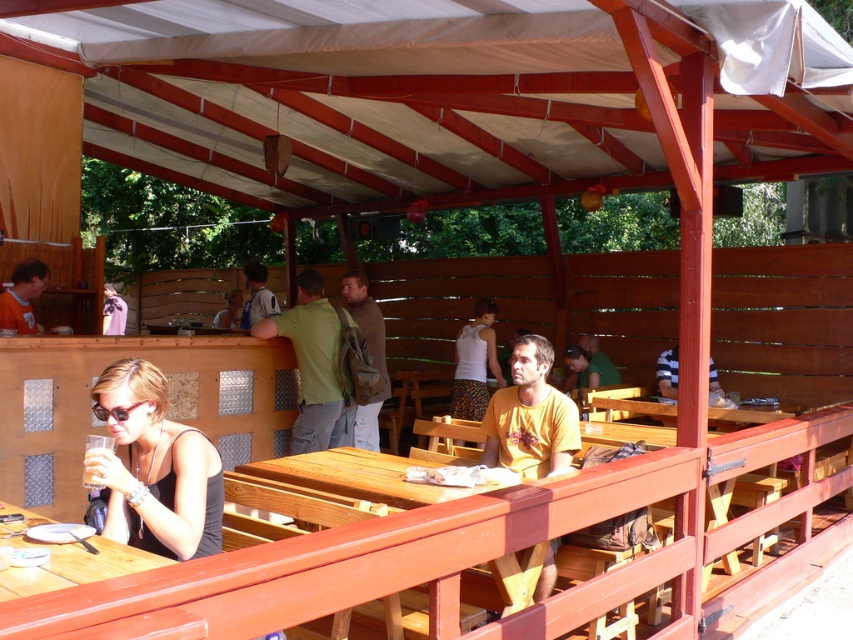
Question: Is green fabric backpack at center below light blue shirt at center?

Choices:
 (A) no
 (B) yes

Answer: (B)

Question: Does matte green shirt at center appear on the right side of clear plastic cup at lower left?

Choices:
 (A) yes
 (B) no

Answer: (B)

Question: Can you confirm if green fabric backpack at center is wider than clear plastic cup at lower left?

Choices:
 (A) no
 (B) yes

Answer: (A)

Question: Among these points, which one is farthest from the camera?

Choices:
 (A) (334, 397)
 (B) (251, 317)
 (C) (28, 332)

Answer: (B)

Question: Which of the following is the closest to the observer?

Choices:
 (A) (142, 392)
 (B) (370, 442)
 (C) (311, 320)

Answer: (A)

Question: Which point is farther to the camera?

Choices:
 (A) (286, 316)
 (B) (93, 451)
 (C) (120, 326)
 (D) (376, 397)

Answer: (C)